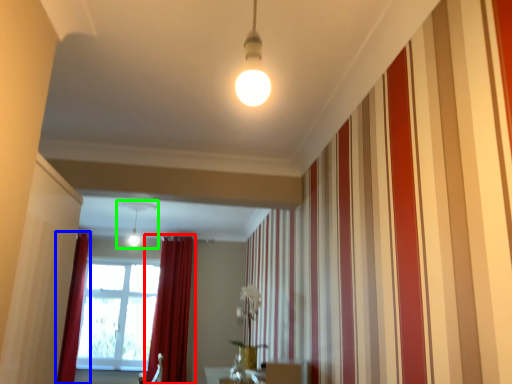
Question: Which object is positioned farthest from curtain (highlighted by a red box)? Select from curtain (highlighted by a blue box) and light fixture (highlighted by a green box).

Choices:
 (A) curtain
 (B) light fixture

Answer: (B)